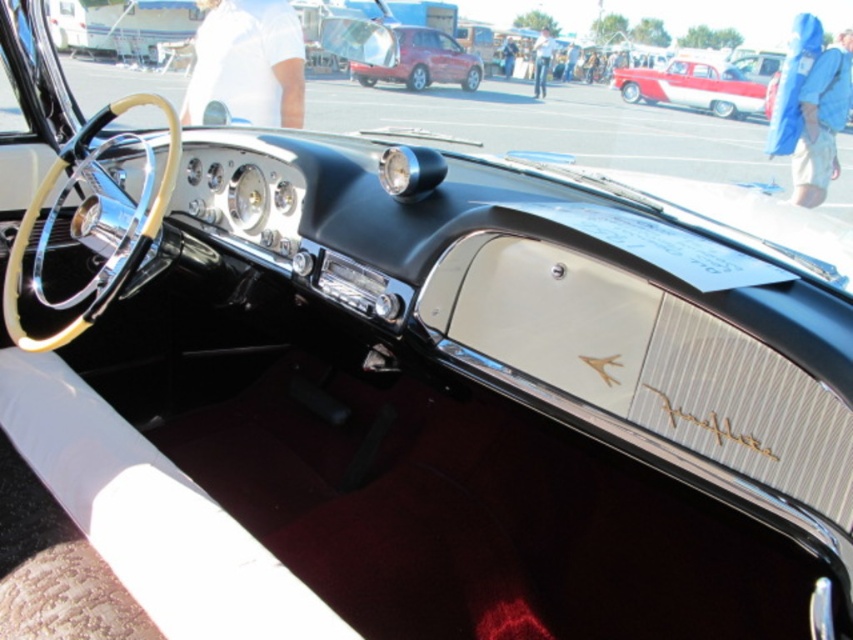
Between white glossy sedan at center and metallic red suv at center, which one has more height?

metallic red suv at center is taller.

Does point (677, 65) come closer to viewer compared to point (462, 80)?

No, (677, 65) is further to viewer.

Describe the element at coordinates (693, 86) in the screenshot. I see `white glossy sedan at center` at that location.

At what (x,y) coordinates should I click in order to perform the action: click on white glossy sedan at center. Please return your answer as a coordinate pair (x, y). Looking at the image, I should click on (693, 86).